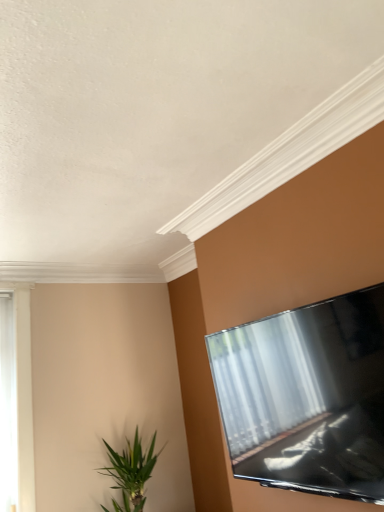
Identify the location of white wooden window at left. The image size is (384, 512). (8, 406).

The image size is (384, 512). What do you see at coordinates (8, 406) in the screenshot?
I see `white wooden window at left` at bounding box center [8, 406].

This screenshot has width=384, height=512. What do you see at coordinates (131, 472) in the screenshot?
I see `green leafy plant at lower left` at bounding box center [131, 472].

Locate an element on the screen. This screenshot has height=512, width=384. green leafy plant at lower left is located at coordinates [x=131, y=472].

Image resolution: width=384 pixels, height=512 pixels. I want to click on white wooden window at left, so click(8, 406).

Between white wooden window at left and green leafy plant at lower left, which one appears on the left side from the viewer's perspective?

white wooden window at left.

Is the depth of white wooden window at left less than that of green leafy plant at lower left?

No, white wooden window at left is behind green leafy plant at lower left.

Which is in front, point (6, 470) or point (125, 511)?

The point (125, 511) is closer to the camera.

From the image's perspective, between white wooden window at left and green leafy plant at lower left, which one is located above?

From the image's view, white wooden window at left is above.

From a real-world perspective, relative to green leafy plant at lower left, is white wooden window at left vertically above or below?

From a real-world perspective, white wooden window at left is physically above green leafy plant at lower left.

Looking at this image, does white wooden window at left have a lesser width compared to green leafy plant at lower left?

Yes, white wooden window at left is thinner than green leafy plant at lower left.

Considering the sizes of white wooden window at left and green leafy plant at lower left in the image, is white wooden window at left taller or shorter than green leafy plant at lower left?

Considering their sizes, white wooden window at left has more height than green leafy plant at lower left.

Based on their sizes in the image, would you say white wooden window at left is bigger or smaller than green leafy plant at lower left?

white wooden window at left is smaller than green leafy plant at lower left.

Is white wooden window at left spatially inside green leafy plant at lower left, or outside of it?

The correct answer is: outside.

Is white wooden window at left touching green leafy plant at lower left?

No, white wooden window at left is not in contact with green leafy plant at lower left.

Is white wooden window at left turned away from green leafy plant at lower left?

white wooden window at left does not have its back to green leafy plant at lower left.

How many degrees apart are the facing directions of white wooden window at left and green leafy plant at lower left?

The angular difference between white wooden window at left and green leafy plant at lower left is 0.52 degrees.

How far apart are white wooden window at left and green leafy plant at lower left?

white wooden window at left and green leafy plant at lower left are 30.66 inches apart from each other.

What are the coordinates of `houseplant in front of the white wooden window at left` in the screenshot? It's located at (131, 472).

Is green leafy plant at lower left at the left side of white wooden window at left?

No.

Is green leafy plant at lower left in front of white wooden window at left?

That is True.

Which is in front, point (138, 441) or point (3, 370)?

The point (3, 370) is in front.

From the image's perspective, is green leafy plant at lower left on top of white wooden window at left?

No, from the image's perspective, green leafy plant at lower left is not over white wooden window at left.

From a real-world perspective, is green leafy plant at lower left physically located above or below white wooden window at left?

green leafy plant at lower left is below white wooden window at left.

Between green leafy plant at lower left and white wooden window at left, which one has larger width?

With larger width is green leafy plant at lower left.

Who is taller, green leafy plant at lower left or white wooden window at left?

white wooden window at left is taller.

Considering the sizes of objects green leafy plant at lower left and white wooden window at left in the image provided, who is bigger, green leafy plant at lower left or white wooden window at left?

green leafy plant at lower left is bigger.

Which is correct: green leafy plant at lower left is inside white wooden window at left, or outside of it?

→ green leafy plant at lower left is not inside white wooden window at left, it's outside.

Are green leafy plant at lower left and white wooden window at left beside each other?

No, green leafy plant at lower left is not next to white wooden window at left.

Is green leafy plant at lower left facing towards white wooden window at left?

No, green leafy plant at lower left is not turned towards white wooden window at left.

Locate an element on the screen. The height and width of the screenshot is (512, 384). window above the green leafy plant at lower left (from a real-world perspective) is located at coordinates (8, 406).

Where is `houseplant lying below the white wooden window at left (from the image's perspective)`? houseplant lying below the white wooden window at left (from the image's perspective) is located at coordinates (131, 472).

The width and height of the screenshot is (384, 512). What are the coordinates of `window above the green leafy plant at lower left (from the image's perspective)` in the screenshot? It's located at (8, 406).